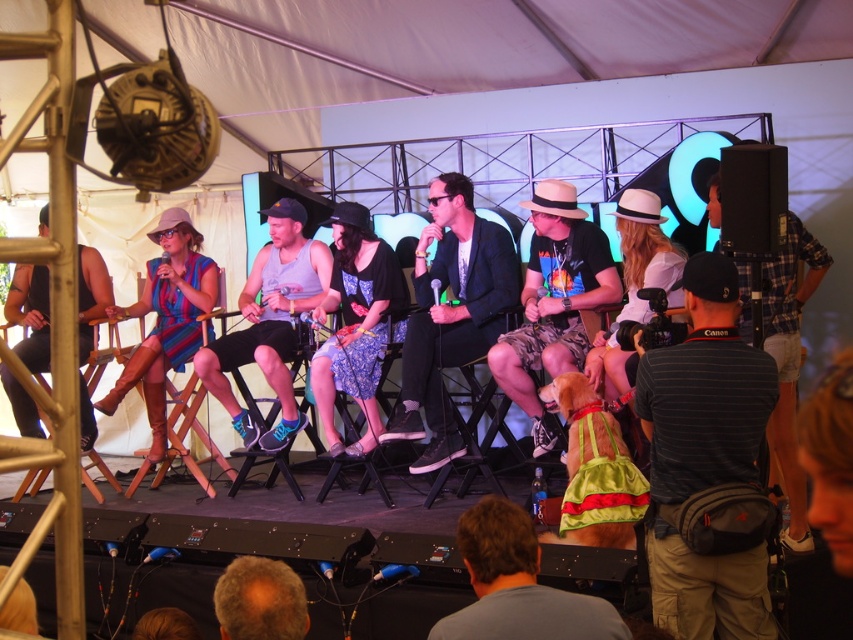
Question: Is matte black tank top at left positioned before matte white hat at center?

Choices:
 (A) no
 (B) yes

Answer: (A)

Question: Is gray tank top at center above matte white hat at center?

Choices:
 (A) no
 (B) yes

Answer: (A)

Question: Which of the following is the farthest from the observer?

Choices:
 (A) dark blue suit at center
 (B) camouflage shorts at center

Answer: (A)

Question: Which point is farther from the camera taking this photo?

Choices:
 (A) (361, 240)
 (B) (659, 202)
 (C) (694, 257)
 (D) (764, 314)

Answer: (A)

Question: Can you confirm if striped cotton shirt at right is positioned to the right of blue floral dress at center?

Choices:
 (A) no
 (B) yes

Answer: (B)

Question: Which is nearer to the light brown hair at lower left?

Choices:
 (A) gray tank top at center
 (B) matte black tank top at left
 (C) dark blue suit at center

Answer: (C)